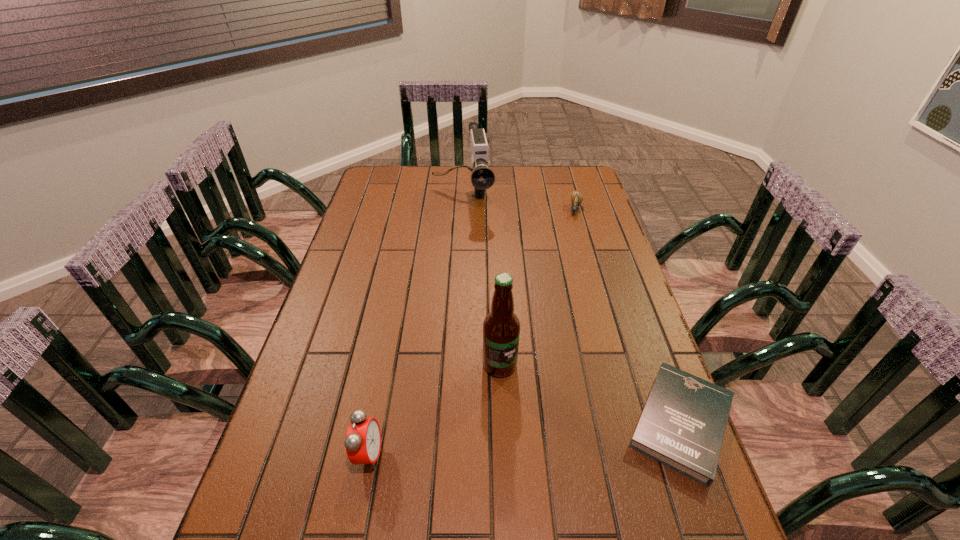
You are a GUI agent. You are given a task and a screenshot of the screen. Output one action in this format:
    pyautogui.click(x=<x>, y=<y>)
    Task: Click on the escargot located at the right edge
    This screenshot has height=540, width=960.
    Given the screenshot: What is the action you would take?
    pyautogui.click(x=576, y=197)

This screenshot has height=540, width=960. In order to click on object that is at the near right corner in this screenshot , I will do `click(683, 423)`.

What are the coordinates of `blank area at the far edge` in the screenshot? It's located at (540, 191).

The width and height of the screenshot is (960, 540). Find the location of `vacant space at the near edge of the desktop`. vacant space at the near edge of the desktop is located at coordinates (461, 497).

The width and height of the screenshot is (960, 540). Identify the location of blank space at the left edge of the desktop. (348, 267).

I want to click on vacant space at the right edge of the desktop, so click(610, 329).

You are a GUI agent. You are given a task and a screenshot of the screen. Output one action in this format:
    pyautogui.click(x=<x>, y=<y>)
    Task: Click on the free space at the far left corner of the desktop
    Image resolution: width=960 pixels, height=540 pixels.
    Given the screenshot: What is the action you would take?
    pyautogui.click(x=389, y=191)

This screenshot has width=960, height=540. What are the coordinates of `blank area at the far right corner` in the screenshot? It's located at (590, 186).

This screenshot has height=540, width=960. What are the coordinates of `free space at the near right corner of the desktop` in the screenshot? It's located at (689, 514).

Image resolution: width=960 pixels, height=540 pixels. Identify the location of vacant point located between the book and the fourth tallest object. (629, 316).